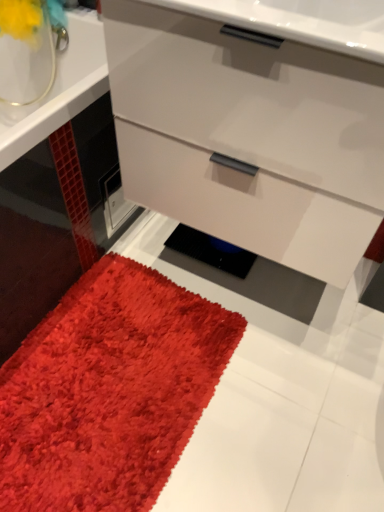
Question: Considering the relative sizes of matte white chest of drawers at center and matte yellow flower at upper left in the image provided, is matte white chest of drawers at center thinner than matte yellow flower at upper left?

Choices:
 (A) no
 (B) yes

Answer: (A)

Question: Does matte white chest of drawers at center have a greater width compared to matte yellow flower at upper left?

Choices:
 (A) yes
 (B) no

Answer: (A)

Question: Is matte white chest of drawers at center not within matte yellow flower at upper left?

Choices:
 (A) yes
 (B) no

Answer: (A)

Question: Is matte white chest of drawers at center at the left side of matte yellow flower at upper left?

Choices:
 (A) yes
 (B) no

Answer: (B)

Question: Considering the relative sizes of matte white chest of drawers at center and matte yellow flower at upper left in the image provided, is matte white chest of drawers at center bigger than matte yellow flower at upper left?

Choices:
 (A) yes
 (B) no

Answer: (A)

Question: Is the depth of matte white chest of drawers at center less than that of matte yellow flower at upper left?

Choices:
 (A) yes
 (B) no

Answer: (A)

Question: Is matte yellow flower at upper left bigger than shaggy red carpet at lower left?

Choices:
 (A) yes
 (B) no

Answer: (B)

Question: Does matte yellow flower at upper left contain shaggy red carpet at lower left?

Choices:
 (A) no
 (B) yes

Answer: (A)

Question: From the image's perspective, is matte yellow flower at upper left below shaggy red carpet at lower left?

Choices:
 (A) yes
 (B) no

Answer: (B)

Question: Can you confirm if matte yellow flower at upper left is thinner than shaggy red carpet at lower left?

Choices:
 (A) no
 (B) yes

Answer: (B)

Question: Is matte yellow flower at upper left at the left side of shaggy red carpet at lower left?

Choices:
 (A) yes
 (B) no

Answer: (A)

Question: Is matte yellow flower at upper left oriented away from shaggy red carpet at lower left?

Choices:
 (A) yes
 (B) no

Answer: (B)

Question: From a real-world perspective, is shaggy red carpet at lower left under matte yellow flower at upper left?

Choices:
 (A) no
 (B) yes

Answer: (B)